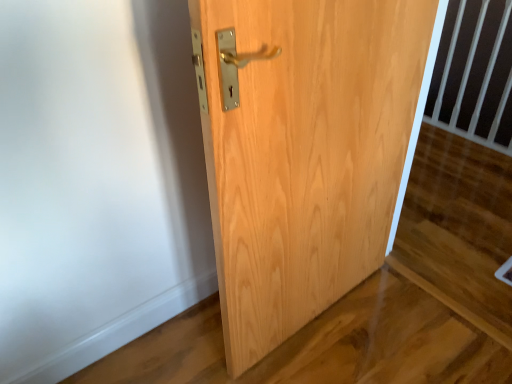
Locate an element on the screen. free space in front of natural wood door at center is located at coordinates pos(321,352).